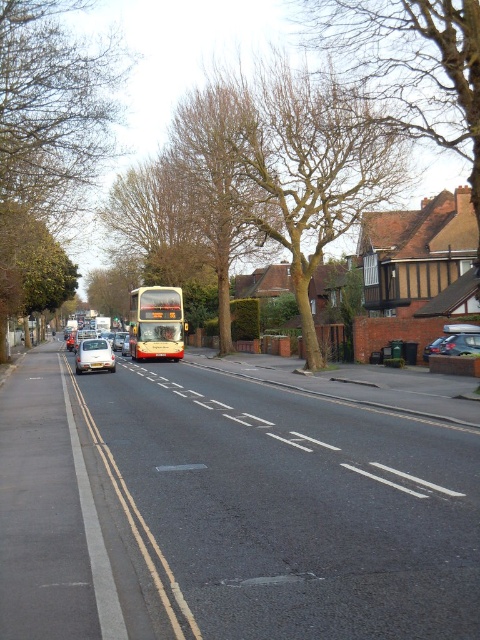
Question: Does bare branches at upper center appear on the left side of metallic silver car at center?

Choices:
 (A) no
 (B) yes

Answer: (B)

Question: Which point is closer to the camera?

Choices:
 (A) (167, 316)
 (B) (387, 188)
 (C) (100, 362)

Answer: (C)

Question: Can you confirm if brown leafless tree at upper left is positioned below white matte car at left?

Choices:
 (A) yes
 (B) no

Answer: (B)

Question: Is bare branches at upper center below metallic silver car at center?

Choices:
 (A) no
 (B) yes

Answer: (A)

Question: Estimate the real-world distances between objects in this image. Which object is farther from the brown leafless tree at upper center?

Choices:
 (A) bare branches at upper center
 (B) yellow metallic bus at center
 (C) white plastic license plate at center

Answer: (C)

Question: Which point is closer to the camera?

Choices:
 (A) (400, 173)
 (B) (80, 353)
 (C) (24, 44)
 (D) (103, 364)

Answer: (C)